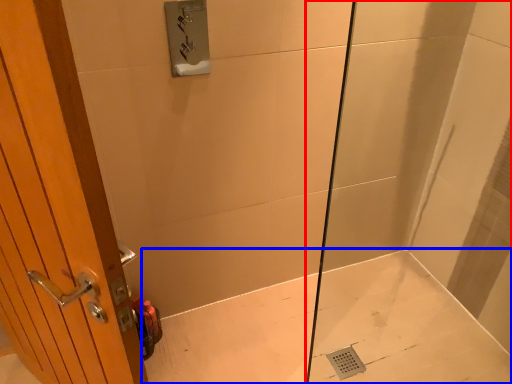
Question: Which object appears farthest to the camera in this image, shower door (highlighted by a red box) or bath (highlighted by a blue box)?

Choices:
 (A) shower door
 (B) bath

Answer: (B)